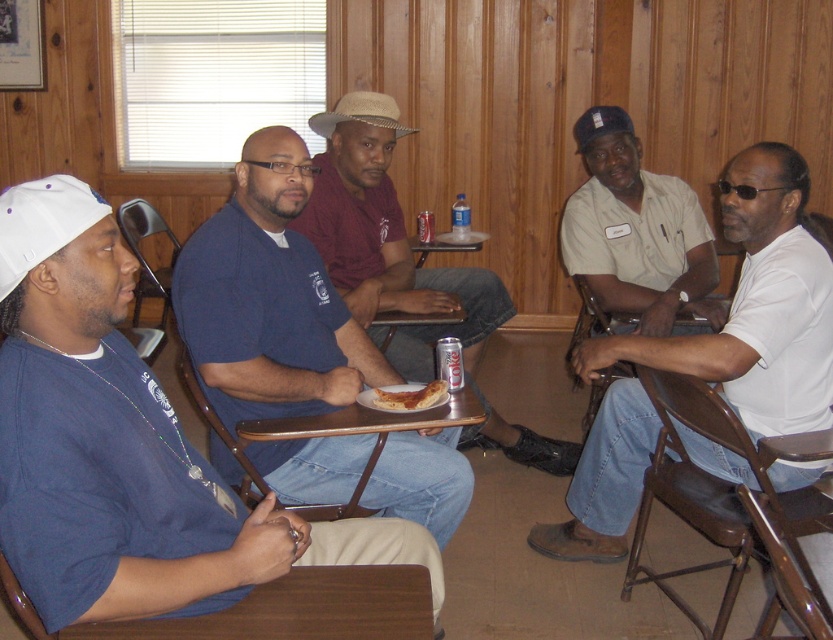
You are organizing a small gathering and need to place both the golden crispy pizza slice at center and the wooden tray at center on a small table. Based on the scene, which item takes up more space on the table?

The wooden tray at center takes up more space than the golden crispy pizza slice at center because the pizza slice occupies less space than the wooden tray according to the description.

You are a photographer standing in the room. You want to take a photo of the strawhat at center and the clear plastic bottle at center. Which object will appear larger in the photo?

The strawhat at center will appear larger in the photo because it is closer to the viewer than the clear plastic bottle at center.

What is the relationship between the width of the brown wood folding chair at lower right and the clear plastic bottle at center?

The brown wood folding chair at lower right is wider than the clear plastic bottle at center.